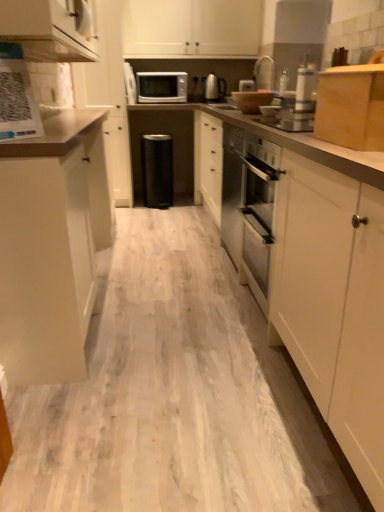
This screenshot has height=512, width=384. What do you see at coordinates (192, 28) in the screenshot? I see `white matte cabinet at upper center, marked as the fourth cabinetry in a left-to-right arrangement` at bounding box center [192, 28].

I want to click on white matte cabinet at upper center, marked as the fourth cabinetry in a left-to-right arrangement, so (x=192, y=28).

Considering the relative sizes of metallic silver kettle at upper center, the first appliance positioned from the back, and white glossy qr code at upper left in the image provided, is metallic silver kettle at upper center, the first appliance positioned from the back, thinner than white glossy qr code at upper left?

No.

At what (x,y) coordinates should I click in order to perform the action: click on kitchen appliance that appears below the metallic silver kettle at upper center, the second appliance when ordered from left to right (from the image's perspective). Please return your answer as a coordinate pair (x, y). The height and width of the screenshot is (512, 384). Looking at the image, I should click on (17, 97).

In the scene shown: From the image's perspective, is metallic silver kettle at upper center, positioned as the second appliance in right-to-left order, located above or below white glossy qr code at upper left?

metallic silver kettle at upper center, positioned as the second appliance in right-to-left order, is above white glossy qr code at upper left.

What's the angular difference between white glossy microwave at upper center, the 2th appliance in the back-to-front sequence, and metallic silver toaster at upper center, the 3th appliance viewed from the left,'s facing directions?

The angular difference between white glossy microwave at upper center, the 2th appliance in the back-to-front sequence, and metallic silver toaster at upper center, the 3th appliance viewed from the left, is 92.7 degrees.

Measure the distance between white glossy microwave at upper center, the second appliance positioned from the front, and metallic silver toaster at upper center, the 3th appliance viewed from the left.

1.15 meters.

Considering the sizes of objects white glossy microwave at upper center, the second appliance positioned from the front, and metallic silver toaster at upper center, the first appliance from the front, in the image provided, who is smaller, white glossy microwave at upper center, the second appliance positioned from the front, or metallic silver toaster at upper center, the first appliance from the front,?

metallic silver toaster at upper center, the first appliance from the front, is smaller.

From the image's perspective, which is below, white glossy microwave at upper center, arranged as the 1th appliance when viewed from the left, or metallic silver toaster at upper center, positioned as the first appliance in right-to-left order?

From the image's view, metallic silver toaster at upper center, positioned as the first appliance in right-to-left order, is below.

Is white glossy qr code at upper left at the left side of black matte dishwasher at center?

Indeed, white glossy qr code at upper left is positioned on the left side of black matte dishwasher at center.

Does white glossy qr code at upper left turn towards black matte dishwasher at center?

No, white glossy qr code at upper left does not turn towards black matte dishwasher at center.

Considering the positions of point (40, 128) and point (150, 154), is point (40, 128) closer or farther from the camera than point (150, 154)?

Point (40, 128).

You are a GUI agent. You are given a task and a screenshot of the screen. Output one action in this format:
    pyautogui.click(x=<x>, y=<y>)
    Task: Click on the kitchen appliance that is above the black matte dishwasher at center (from a real-world perspective)
    
    Given the screenshot: What is the action you would take?
    pyautogui.click(x=17, y=97)

Is white glossy qr code at upper left surrounding matte white cabinet at left, acting as the third cabinetry starting from the right?

No, matte white cabinet at left, acting as the third cabinetry starting from the right, is not surrounded by white glossy qr code at upper left.

Can you confirm if white glossy qr code at upper left is wider than matte white cabinet at left, which appears as the 3th cabinetry when viewed from the left?

In fact, white glossy qr code at upper left might be narrower than matte white cabinet at left, which appears as the 3th cabinetry when viewed from the left.

At what (x,y) coordinates should I click in order to perform the action: click on kitchen appliance above the matte white cabinet at left, acting as the third cabinetry starting from the right (from a real-world perspective). Please return your answer as a coordinate pair (x, y). Looking at the image, I should click on (17, 97).

Looking at the image, does white glossy qr code at upper left seem bigger or smaller compared to matte white cabinet at left, which appears as the 3th cabinetry when viewed from the left?

white glossy qr code at upper left is smaller than matte white cabinet at left, which appears as the 3th cabinetry when viewed from the left.

Is white laminate countertop at center positioned beyond the bounds of white glossy microwave oven at upper center?

Yes, white laminate countertop at center is outside of white glossy microwave oven at upper center.

Considering the points (296, 286) and (176, 76), which point is in front, point (296, 286) or point (176, 76)?

Point (296, 286)

Relative to white glossy microwave oven at upper center, is white laminate countertop at center in front or behind?

white laminate countertop at center is positioned closer to the viewer than white glossy microwave oven at upper center.

From the image's perspective, is white laminate countertop at center located above white glossy microwave oven at upper center?

No.

Considering the sizes of objects white matte cabinet at upper center, marked as the fourth cabinetry in a left-to-right arrangement, and white laminate countertop at center in the image provided, who is smaller, white matte cabinet at upper center, marked as the fourth cabinetry in a left-to-right arrangement, or white laminate countertop at center?

Smaller between the two is white laminate countertop at center.

Looking at their sizes, would you say white matte cabinet at upper center, marked as the fourth cabinetry in a left-to-right arrangement, is wider or thinner than white laminate countertop at center?

In the image, white matte cabinet at upper center, marked as the fourth cabinetry in a left-to-right arrangement, appears to be more narrow than white laminate countertop at center.

Considering their positions, is white matte cabinet at upper center, positioned as the second cabinetry in right-to-left order, located in front of or behind white laminate countertop at center?

Clearly, white matte cabinet at upper center, positioned as the second cabinetry in right-to-left order, is behind white laminate countertop at center.

Is black matte dishwasher at center located outside white matte cabinet at upper left, which appears as the fifth cabinetry when viewed from the right?

Yes, black matte dishwasher at center is located beyond the bounds of white matte cabinet at upper left, which appears as the fifth cabinetry when viewed from the right.

Is black matte dishwasher at center aimed at white matte cabinet at upper left, positioned as the first cabinetry in left-to-right order?

→ No, black matte dishwasher at center is not turned towards white matte cabinet at upper left, positioned as the first cabinetry in left-to-right order.

From the image's perspective, does black matte dishwasher at center appear lower than white matte cabinet at upper left, which appears as the fifth cabinetry when viewed from the right?

Indeed, from the image's perspective, black matte dishwasher at center is shown beneath white matte cabinet at upper left, which appears as the fifth cabinetry when viewed from the right.

From a real-world perspective, is black matte dishwasher at center under white matte cabinet at upper left, which appears as the fifth cabinetry when viewed from the right?

Yes, from a real-world perspective, black matte dishwasher at center is beneath white matte cabinet at upper left, which appears as the fifth cabinetry when viewed from the right.

This screenshot has height=512, width=384. I want to click on the 2nd appliance to the right of the white glossy qr code at upper left, counting from the anchor's position, so click(214, 88).

From the metallic silver toaster at upper center, positioned as the first appliance in right-to-left order, count 1st appliances backward and point to it. Please provide its 2D coordinates.

[(130, 84)]

Based on their spatial positions, is metallic silver kettle at upper center, positioned as the second appliance in right-to-left order, or white laminate countertop at center closer to white glossy qr code at upper left?

white laminate countertop at center lies closer to white glossy qr code at upper left than the other object.

Which object lies nearer to the anchor point white laminate countertop at center, white matte cabinet at upper center, marked as the fourth cabinetry in a left-to-right arrangement, or white matte cabinet at upper left, positioned as the first cabinetry in left-to-right order?

white matte cabinet at upper left, positioned as the first cabinetry in left-to-right order, is closer to white laminate countertop at center.

In the scene shown: Based on their spatial positions, is white glossy microwave oven at upper center or metallic silver kettle at upper center, which is counted as the third appliance, starting from the front, further from white glossy cabinet at upper left, the fourth cabinetry when ordered from right to left?

Based on the image, metallic silver kettle at upper center, which is counted as the third appliance, starting from the front, appears to be further to white glossy cabinet at upper left, the fourth cabinetry when ordered from right to left.

When comparing their distances from matte white cabinet at left, acting as the third cabinetry starting from the right, does white matte cabinet at upper center, marked as the fourth cabinetry in a left-to-right arrangement, or white glossy qr code at upper left seem further?

The object further to matte white cabinet at left, acting as the third cabinetry starting from the right, is white matte cabinet at upper center, marked as the fourth cabinetry in a left-to-right arrangement.

Considering their positions, is white glossy qr code at upper left positioned further to white matte cabinet at upper center, marked as the fourth cabinetry in a left-to-right arrangement, than metallic silver toaster at upper center, positioned as the first appliance in right-to-left order?

white glossy qr code at upper left lies further to white matte cabinet at upper center, marked as the fourth cabinetry in a left-to-right arrangement, than the other object.

Looking at the image, which one is located further to white glossy cabinet at upper left, the fourth cabinetry when ordered from right to left, white glossy qr code at upper left or white matte cabinet at upper left, positioned as the first cabinetry in left-to-right order?

Based on the image, white matte cabinet at upper left, positioned as the first cabinetry in left-to-right order, appears to be further to white glossy cabinet at upper left, the fourth cabinetry when ordered from right to left.

Considering their positions, is metallic silver kettle at upper center, which is counted as the third appliance, starting from the front, positioned further to wooden box at upper right, the first cabinetry in the right-to-left sequence, than white matte cabinet at upper left, positioned as the first cabinetry in left-to-right order?

metallic silver kettle at upper center, which is counted as the third appliance, starting from the front, is further to wooden box at upper right, the first cabinetry in the right-to-left sequence.

Considering their positions, is metallic silver toaster at upper center, the 3th appliance viewed from the left, positioned further to white matte cabinet at upper left, which appears as the fifth cabinetry when viewed from the right, than white laminate countertop at center?

white laminate countertop at center lies further to white matte cabinet at upper left, which appears as the fifth cabinetry when viewed from the right, than the other object.

Where is `kitchen appliance between wooden box at upper right, the 5th cabinetry when ordered from left to right, and white glossy microwave oven at upper center in the front-back direction`? The height and width of the screenshot is (512, 384). kitchen appliance between wooden box at upper right, the 5th cabinetry when ordered from left to right, and white glossy microwave oven at upper center in the front-back direction is located at coordinates (17, 97).

You are a GUI agent. You are given a task and a screenshot of the screen. Output one action in this format:
    pyautogui.click(x=<x>, y=<y>)
    Task: Click on the countertop between wooden box at upper right, the first cabinetry in the right-to-left sequence, and white matte cabinet at upper center, positioned as the second cabinetry in right-to-left order, in the front-back direction
    This screenshot has height=512, width=384.
    Given the screenshot: What is the action you would take?
    pyautogui.click(x=315, y=269)

I want to click on microwave oven positioned between white glossy cabinet at upper left, arranged as the 2th cabinetry when viewed from the left, and metallic silver kettle at upper center, the second appliance when ordered from left to right, from near to far, so click(x=161, y=87).

At what (x,y) coordinates should I click in order to perform the action: click on cabinetry situated between white glossy microwave at upper center, the third appliance when ordered from right to left, and metallic silver kettle at upper center, positioned as the second appliance in right-to-left order, from left to right. Please return your answer as a coordinate pair (x, y). The image size is (384, 512). Looking at the image, I should click on 192,28.